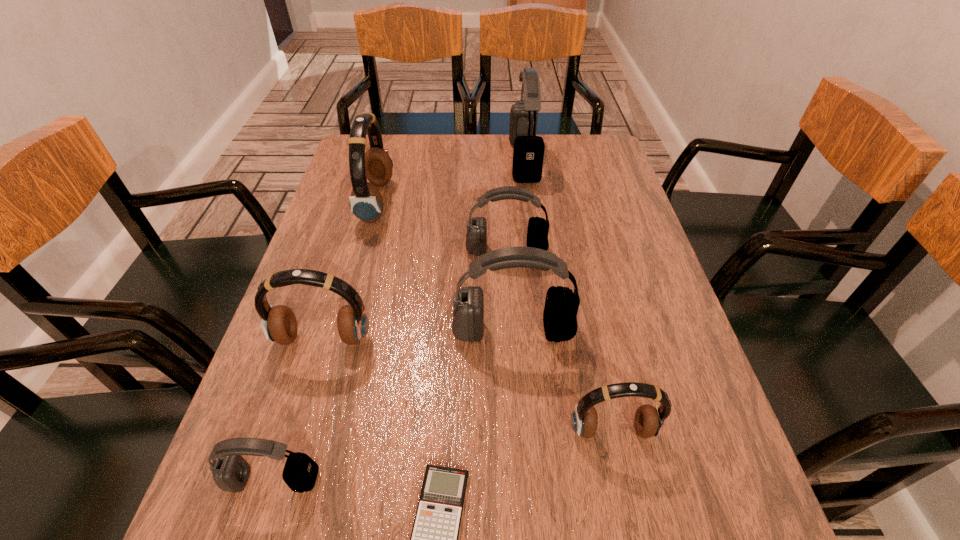
The width and height of the screenshot is (960, 540). What are the coordinates of `vacant space located on the headband of the biggest black headset` in the screenshot? It's located at (402, 160).

Locate an element on the screen. Image resolution: width=960 pixels, height=540 pixels. blank area located on the headband of the biggest black headset is located at coordinates (492, 160).

I want to click on vacant space located on the headband of the biggest black headset, so click(x=396, y=160).

At what (x,y) coordinates should I click in order to perform the action: click on vacant area located 0.290m on the ear cup of the farthest brown headset. Please return your answer as a coordinate pair (x, y). The height and width of the screenshot is (540, 960). Looking at the image, I should click on (494, 202).

This screenshot has height=540, width=960. I want to click on free spot located 0.170m on the headband of the third smallest black headset, so click(519, 424).

I want to click on free space located on the ear cup of the second biggest brown headset, so click(271, 515).

The image size is (960, 540). What are the coordinates of `blank space located 0.230m on the headband of the fifth nearest headset` in the screenshot? It's located at (512, 333).

You are a GUI agent. You are given a task and a screenshot of the screen. Output one action in this format:
    pyautogui.click(x=<x>, y=<y>)
    Task: Click on the free location located 0.070m on the ear cup of the smallest brown headset
    This screenshot has height=540, width=960.
    Given the screenshot: What is the action you would take?
    pos(625,488)

Identify the location of object present at the far edge. The width and height of the screenshot is (960, 540). (528, 152).

Image resolution: width=960 pixels, height=540 pixels. I want to click on object that is at the right edge, so click(x=649, y=421).